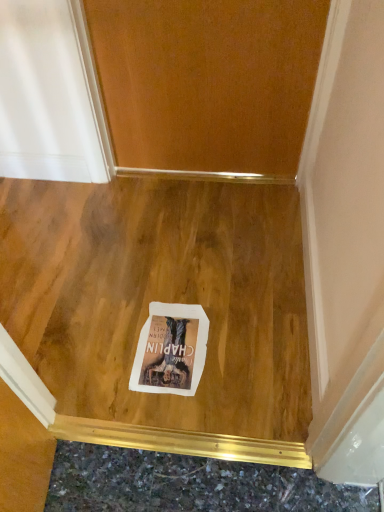
You are a GUI agent. You are given a task and a screenshot of the screen. Output one action in this format:
    pyautogui.click(x=<x>, y=<y>)
    Task: Click on the free space in front of white paper postcard at center
    
    Given the screenshot: What is the action you would take?
    pyautogui.click(x=173, y=416)